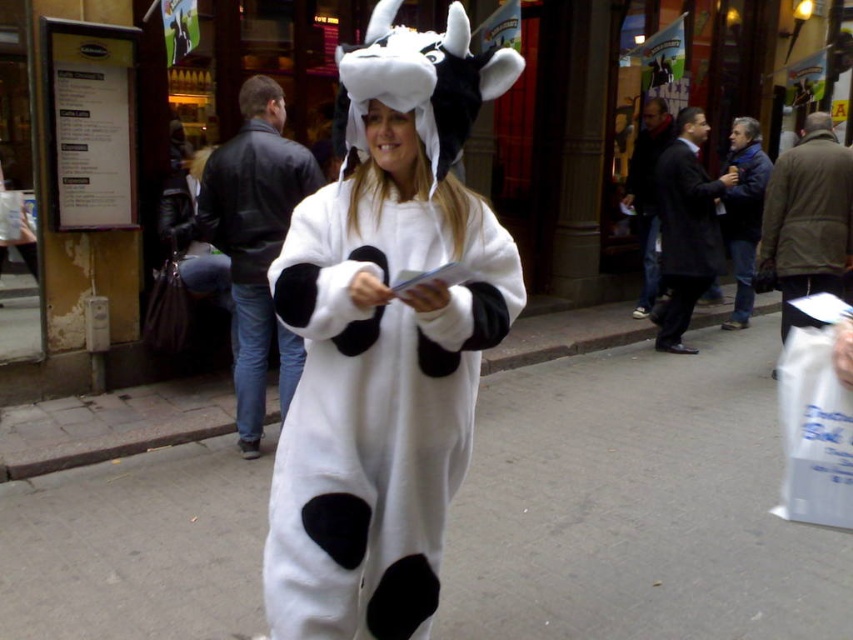
What do you see at coordinates (386, 340) in the screenshot? The width and height of the screenshot is (853, 640). I see `white fuzzy onesie at center` at bounding box center [386, 340].

Who is positioned more to the right, white fuzzy onesie at center or matte black coat at center?

From the viewer's perspective, matte black coat at center appears more on the right side.

Locate an element on the screen. The height and width of the screenshot is (640, 853). white fuzzy onesie at center is located at coordinates (386, 340).

Can you confirm if white smooth pavement at center is positioned below white paper bag at lower right?

Correct, white smooth pavement at center is located below white paper bag at lower right.

Does white smooth pavement at center have a lesser height compared to white paper bag at lower right?

In fact, white smooth pavement at center may be taller than white paper bag at lower right.

Which is behind, point (160, 490) or point (808, 333)?

Positioned behind is point (160, 490).

Identify the location of white smooth pavement at center. This screenshot has height=640, width=853. (637, 506).

Can you confirm if white fuzzy onesie at center is taller than white paper bag at lower right?

Yes.

Between white fuzzy onesie at center and white paper bag at lower right, which one has more height?

white fuzzy onesie at center

What do you see at coordinates (386, 340) in the screenshot?
I see `white fuzzy onesie at center` at bounding box center [386, 340].

You are a GUI agent. You are given a task and a screenshot of the screen. Output one action in this format:
    pyautogui.click(x=<x>, y=<y>)
    Task: Click on the white fuzzy onesie at center
    Image resolution: width=853 pixels, height=640 pixels.
    Given the screenshot: What is the action you would take?
    pyautogui.click(x=386, y=340)